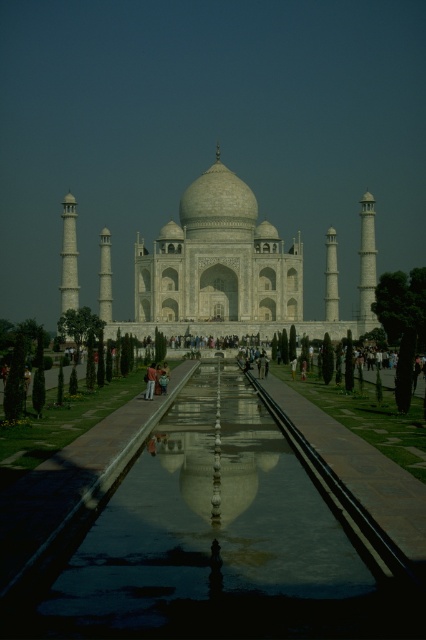
Question: Observing the image, what is the correct spatial positioning of white marble taj mahal at center in reference to light brown fabric person at center?

Choices:
 (A) above
 (B) below

Answer: (A)

Question: Can you confirm if glossy reflective pool at center is positioned to the left of white marble taj mahal at center?

Choices:
 (A) no
 (B) yes

Answer: (B)

Question: Which of the following is the farthest from the observer?

Choices:
 (A) light brown fabric person at center
 (B) glossy reflective pool at center

Answer: (A)

Question: Which object is the closest to the white marble taj mahal at center?

Choices:
 (A) glossy reflective pool at center
 (B) light brown fabric person at center

Answer: (B)

Question: Which point appears farthest from the camera in this image?

Choices:
 (A) (149, 394)
 (B) (334, 326)

Answer: (B)

Question: Can you confirm if glossy reflective pool at center is smaller than light brown fabric person at center?

Choices:
 (A) no
 (B) yes

Answer: (A)